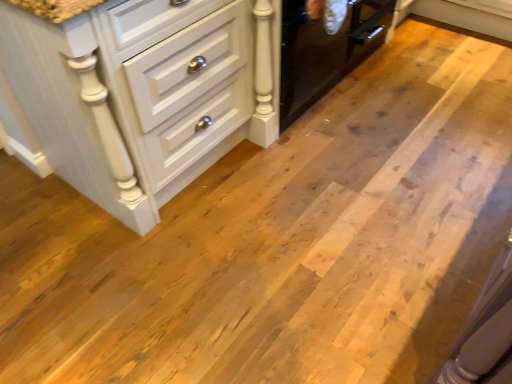
The image size is (512, 384). I want to click on free space in front of white painted wood chest of drawers at left, so click(x=165, y=284).